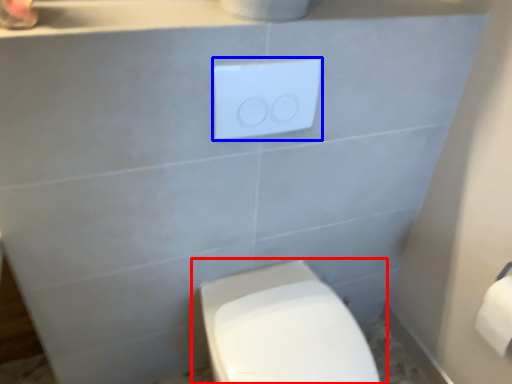
Question: Among these objects, which one is farthest to the camera, toilet (highlighted by a red box) or light switch (highlighted by a blue box)?

Choices:
 (A) toilet
 (B) light switch

Answer: (B)